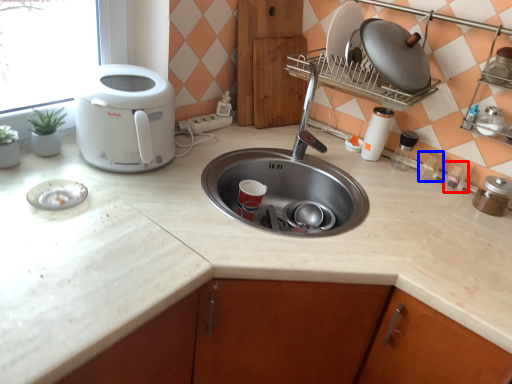
Question: Which of the following is the closest to the observer, appliance (highlighted by a red box) or appliance (highlighted by a blue box)?

Choices:
 (A) appliance
 (B) appliance

Answer: (A)